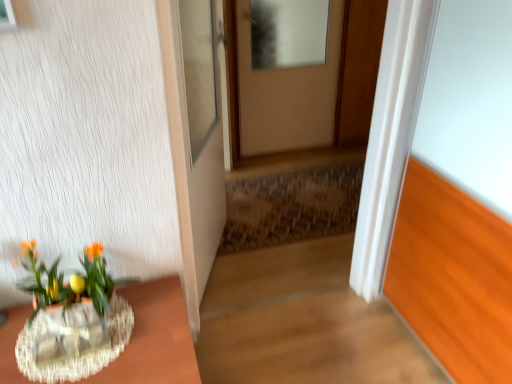
Question: From a real-world perspective, is white glossy door at center, the first door viewed from the left, located beneath rustic wooden stairwell at center?

Choices:
 (A) yes
 (B) no

Answer: (B)

Question: From a real-world perspective, is white glossy door at center, placed as the 1th door when sorted from front to back, physically above rustic wooden stairwell at center?

Choices:
 (A) no
 (B) yes

Answer: (B)

Question: From the image's perspective, is white glossy door at center, the first door viewed from the left, located beneath rustic wooden stairwell at center?

Choices:
 (A) yes
 (B) no

Answer: (B)

Question: Can you confirm if white glossy door at center, the first door viewed from the left, is positioned to the right of rustic wooden stairwell at center?

Choices:
 (A) no
 (B) yes

Answer: (A)

Question: Does white glossy door at center, which appears as the 2th door when viewed from the back, lie in front of rustic wooden stairwell at center?

Choices:
 (A) yes
 (B) no

Answer: (A)

Question: Is rustic wooden stairwell at center spatially inside white glossy door at center, which appears as the 2th door when viewed from the back, or outside of it?

Choices:
 (A) outside
 (B) inside

Answer: (A)

Question: From the image's perspective, is rustic wooden stairwell at center above or below white glossy door at center, which appears as the 2th door when viewed from the back?

Choices:
 (A) above
 (B) below

Answer: (B)

Question: Considering the relative positions of rustic wooden stairwell at center and white glossy door at center, which appears as the 2th door when viewed from the back, in the image provided, is rustic wooden stairwell at center to the left or to the right of white glossy door at center, which appears as the 2th door when viewed from the back,?

Choices:
 (A) right
 (B) left

Answer: (A)

Question: Relative to white glossy door at center, placed as the 1th door when sorted from front to back, is rustic wooden stairwell at center in front or behind?

Choices:
 (A) behind
 (B) front

Answer: (A)

Question: Would you say clear glass vase at lower left is inside or outside translucent glass vase at lower left?

Choices:
 (A) inside
 (B) outside

Answer: (B)

Question: From the image's perspective, relative to translucent glass vase at lower left, is clear glass vase at lower left above or below?

Choices:
 (A) above
 (B) below

Answer: (A)

Question: Visually, is clear glass vase at lower left positioned to the left or to the right of translucent glass vase at lower left?

Choices:
 (A) left
 (B) right

Answer: (B)

Question: From a real-world perspective, relative to translucent glass vase at lower left, is clear glass vase at lower left vertically above or below?

Choices:
 (A) above
 (B) below

Answer: (A)

Question: In terms of height, does translucent glass vase at lower left look taller or shorter compared to rustic wooden stairwell at center?

Choices:
 (A) tall
 (B) short

Answer: (B)

Question: In terms of width, does translucent glass vase at lower left look wider or thinner when compared to rustic wooden stairwell at center?

Choices:
 (A) wide
 (B) thin

Answer: (B)